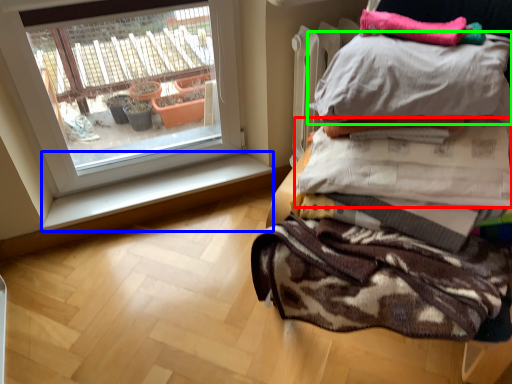
Question: Considering the real-world distances, which object is closest to blanket (highlighted by a red box)? window sill (highlighted by a blue box) or pillow (highlighted by a green box).

Choices:
 (A) window sill
 (B) pillow

Answer: (B)